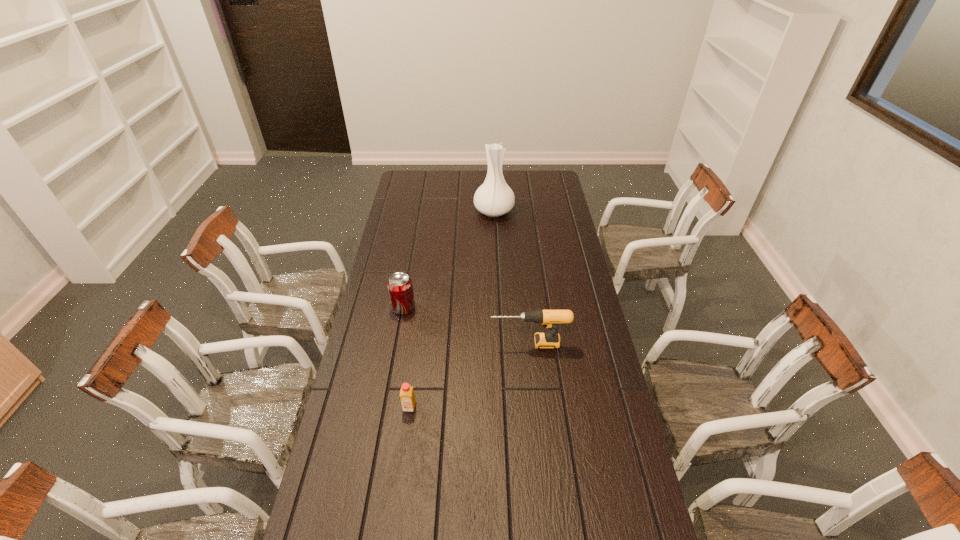
At what (x,y) coordinates should I click in order to perform the action: click on free spot that satisfies the following two spatial constraints: 1. on the handle side of the drill; 2. on the front and back of the third object from right to left. Please return your answer as a coordinate pair (x, y). This screenshot has height=540, width=960. Looking at the image, I should click on (536, 407).

The width and height of the screenshot is (960, 540). I want to click on free spot that satisfies the following two spatial constraints: 1. on the handle side of the drill; 2. on the front and back of the third object from right to left, so click(536, 407).